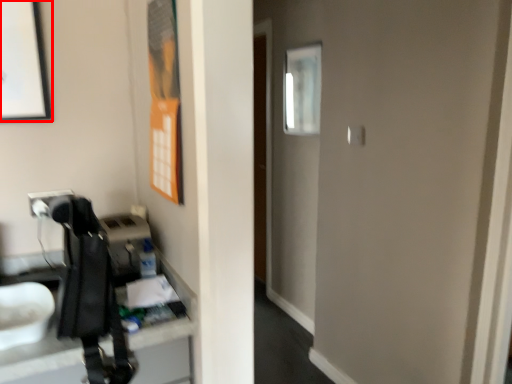
Question: Where is picture frame (annotated by the red box) located in relation to mirror in the image?

Choices:
 (A) right
 (B) left

Answer: (B)